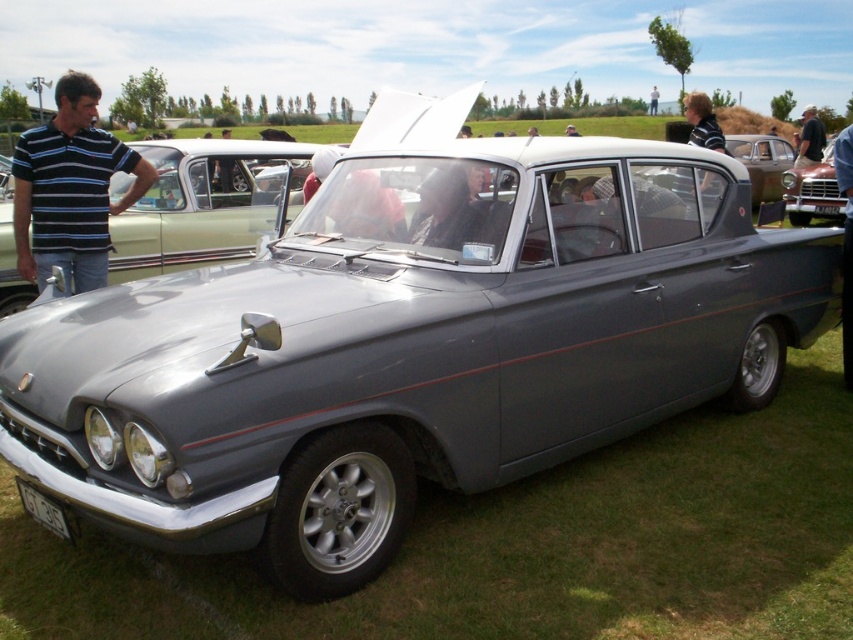
Can you confirm if blue striped polo shirt at left is positioned to the right of metallic red car at center?

No, blue striped polo shirt at left is not to the right of metallic red car at center.

Is point (39, 156) positioned before point (828, 202)?

Yes.

Is point (137, 161) farther from camera compared to point (788, 195)?

No, it is not.

The width and height of the screenshot is (853, 640). Find the location of `blue striped polo shirt at left`. blue striped polo shirt at left is located at coordinates (70, 189).

Where is `metallic red car at center`? Image resolution: width=853 pixels, height=640 pixels. metallic red car at center is located at coordinates (813, 189).

Which is more to the left, metallic red car at center or matte black shirt at center?

Positioned to the left is metallic red car at center.

This screenshot has width=853, height=640. In order to click on metallic red car at center in this screenshot , I will do `click(813, 189)`.

Is the position of matte black shirt at center more distant than that of dark blue shirt at center?

No, matte black shirt at center is in front of dark blue shirt at center.

Does matte black shirt at center have a greater width compared to dark blue shirt at center?

Yes.

Is point (845, 250) less distant than point (805, 145)?

That is True.

The image size is (853, 640). What are the coordinates of `matte black shirt at center` in the screenshot? It's located at (845, 243).